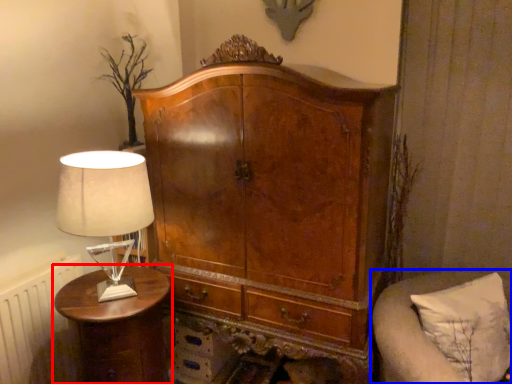
Question: Which point is closer to the camera, nightstand (highlighted by a red box) or furniture (highlighted by a blue box)?

Choices:
 (A) nightstand
 (B) furniture

Answer: (B)